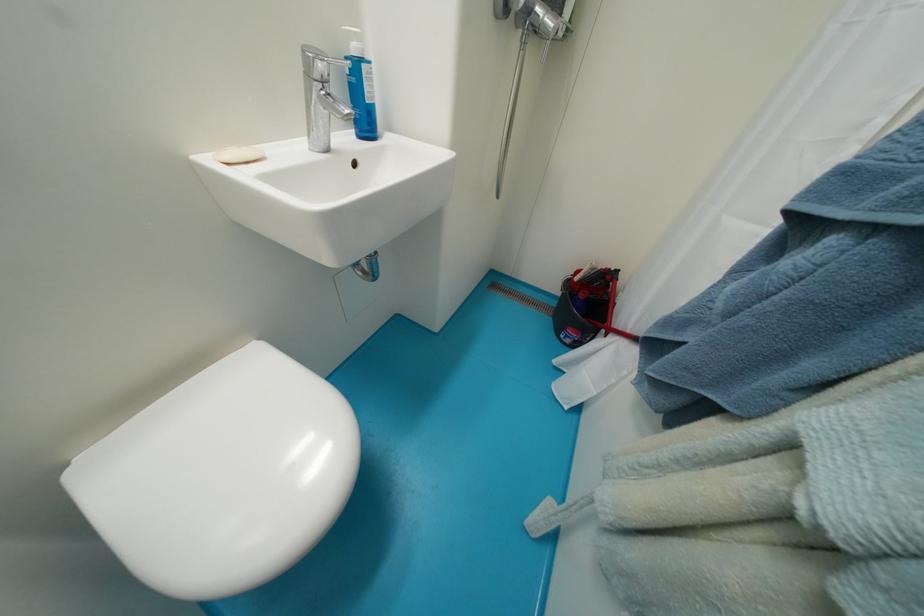
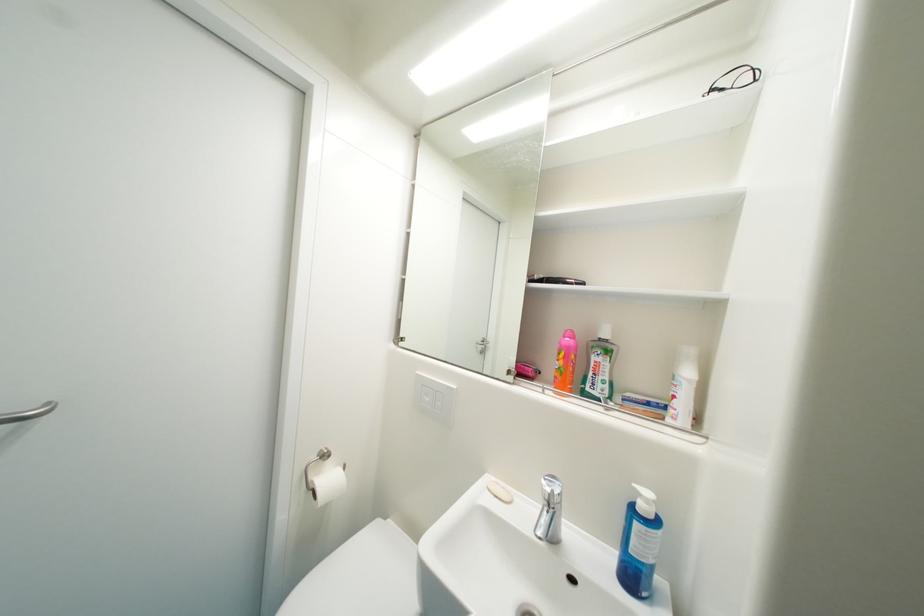
The point at (354,60) is marked in the first image. Where is the corresponding point in the second image?

(641, 507)